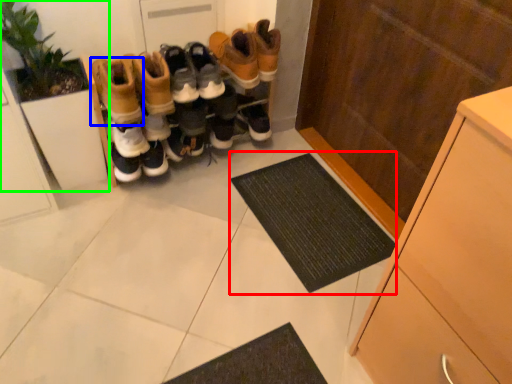
Question: Which object is the closest to the doormat (highlighted by a red box)? Choose among these: footwear (highlighted by a blue box) or houseplant (highlighted by a green box).

Choices:
 (A) footwear
 (B) houseplant

Answer: (A)